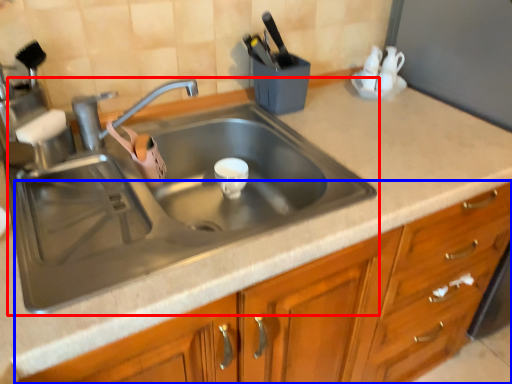
Question: Which object is closer to the camera taking this photo, sink (highlighted by a red box) or cabinetry (highlighted by a blue box)?

Choices:
 (A) sink
 (B) cabinetry

Answer: (B)